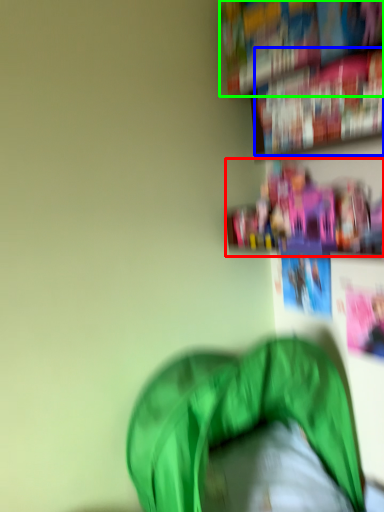
Question: Estimate the real-world distances between objects in this image. Which object is closer to shelf (highlighted by a red box), book (highlighted by a blue box) or book (highlighted by a green box)?

Choices:
 (A) book
 (B) book

Answer: (A)